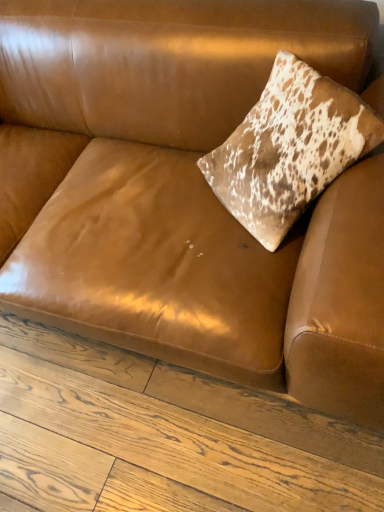
The width and height of the screenshot is (384, 512). What do you see at coordinates (289, 149) in the screenshot?
I see `cowhide pillow at upper right` at bounding box center [289, 149].

You are a GUI agent. You are given a task and a screenshot of the screen. Output one action in this format:
    pyautogui.click(x=<x>, y=<y>)
    Task: Click on the cowhide pillow at upper right
    This screenshot has height=512, width=384.
    Given the screenshot: What is the action you would take?
    pyautogui.click(x=289, y=149)

The width and height of the screenshot is (384, 512). I want to click on cowhide pillow at upper right, so click(x=289, y=149).